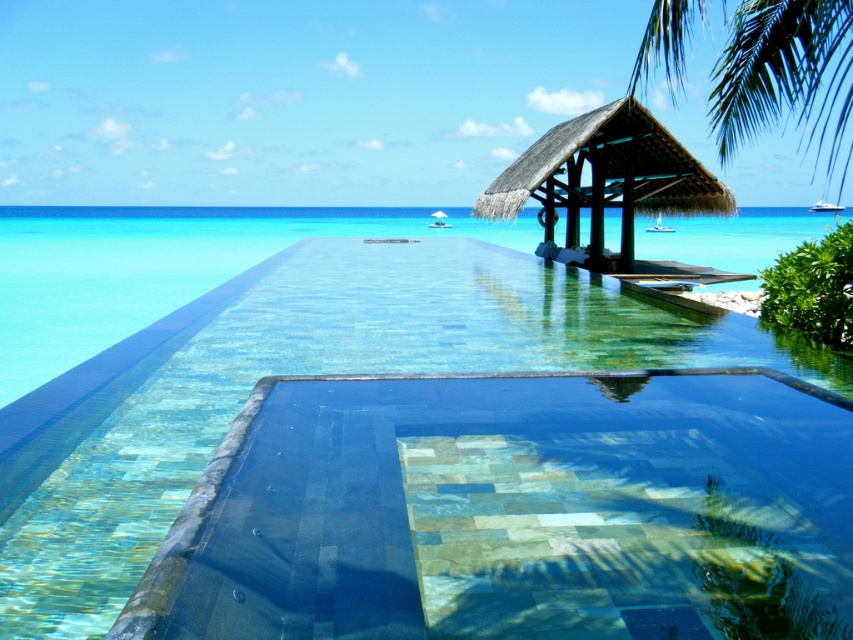
Is translucent mosaic pool at center shorter than green leafy palm tree at upper right?

Correct, translucent mosaic pool at center is not as tall as green leafy palm tree at upper right.

Image resolution: width=853 pixels, height=640 pixels. In order to click on translucent mosaic pool at center in this screenshot , I will do `click(318, 372)`.

Does green leafy palm tree at upper right have a greater width compared to thatched roof gazebo at upper right?

Indeed, green leafy palm tree at upper right has a greater width compared to thatched roof gazebo at upper right.

What do you see at coordinates (785, 76) in the screenshot?
I see `green leafy palm tree at upper right` at bounding box center [785, 76].

Where is `green leafy palm tree at upper right`? The height and width of the screenshot is (640, 853). green leafy palm tree at upper right is located at coordinates (785, 76).

Who is taller, clear glass water at center or thatched roof gazebo at upper right?

Standing taller between the two is clear glass water at center.

Who is lower down, clear glass water at center or thatched roof gazebo at upper right?

thatched roof gazebo at upper right

Measure the distance between clear glass water at center and camera.

The distance of clear glass water at center from camera is 5.93 meters.

Find the location of a particular element. The height and width of the screenshot is (640, 853). clear glass water at center is located at coordinates (158, 268).